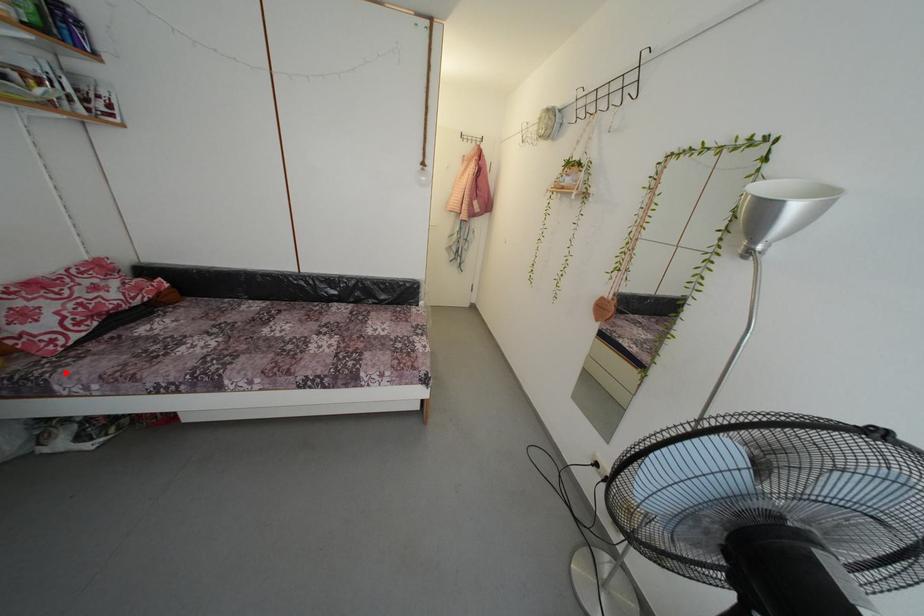
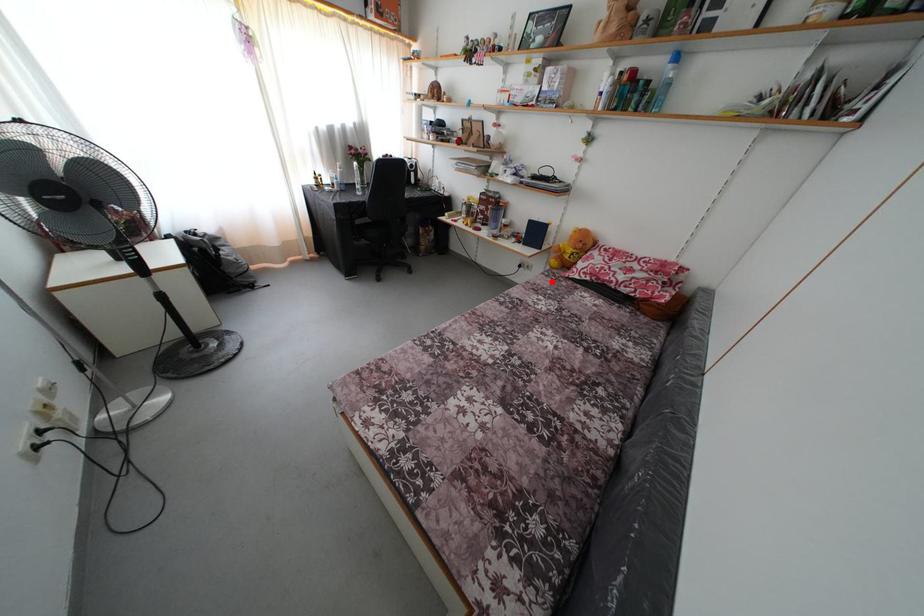
I am providing you with two images of the same scene from different viewpoints. A red point is marked on the first image and another point is marked on the second image. Do the highlighted points in image1 and image2 indicate the same real-world spot?

Yes